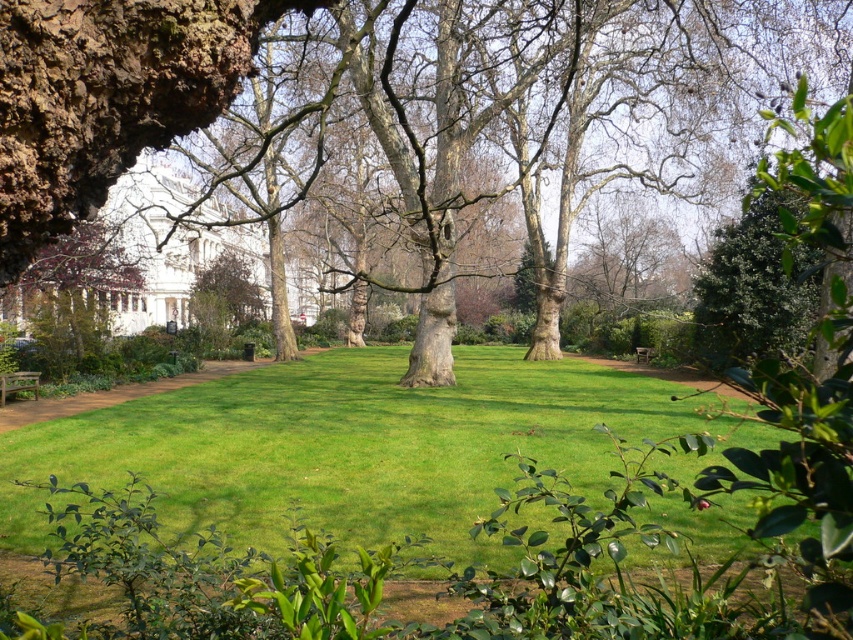
You are a photographer setting up a tripod in the park. You want to capture both the green grass at center and the wooden park bench at center in your shot. Based on their positions, which object will appear closer to the camera in the final photo?

The green grass at center appears closer to the camera in the final photo because it is positioned in front of the wooden park bench at center.

From the picture: You are planning to take a walk in the park and want to sit on one of the wooden park benches. If you walk from the wooden park bench at lower left towards the wooden park bench at center, which direction should you face?

You should face to the right because the wooden park bench at lower left is to the left of the wooden park bench at center, so moving from the left bench to the center bench requires facing right.

You are standing in the park and want to take a photo of the green grass at center without the smooth bark tree at left appearing in the background. Is this possible?

The smooth bark tree at left is behind the green grass at center, so it will appear in the background of the photo. To avoid it, you need to position yourself so the tree is out of the frame or use a different angle where the tree isn